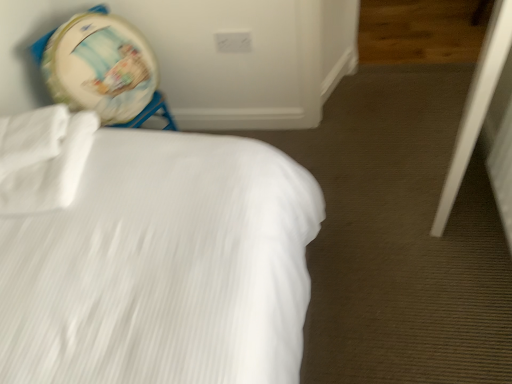
In order to click on vacant region under white plastic screen door at lower right (from a real-world perspective) in this screenshot , I will do pyautogui.click(x=439, y=176).